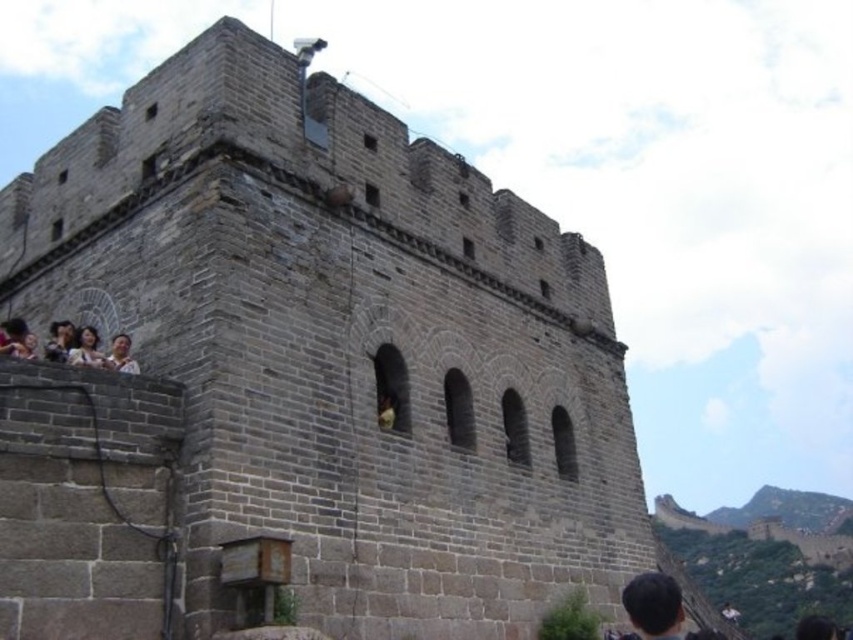
Question: Among these points, which one is farthest from the camera?

Choices:
 (A) (68, 326)
 (B) (82, 333)

Answer: (A)

Question: Is matte gray hair at left in front of matte gray face at lower left?

Choices:
 (A) yes
 (B) no

Answer: (A)

Question: Is light brown wooden chair at left positioned in front of matte gray face at lower left?

Choices:
 (A) yes
 (B) no

Answer: (B)

Question: Which point appears farthest from the camera in this image?

Choices:
 (A) (129, 368)
 (B) (61, 337)

Answer: (B)

Question: Does matte gray hair at left appear on the left side of matte gray face at lower left?

Choices:
 (A) no
 (B) yes

Answer: (B)

Question: Which of the following is the closest to the observer?

Choices:
 (A) light brown wooden chair at left
 (B) matte gray face at lower left
 (C) matte gray hair at left

Answer: (C)